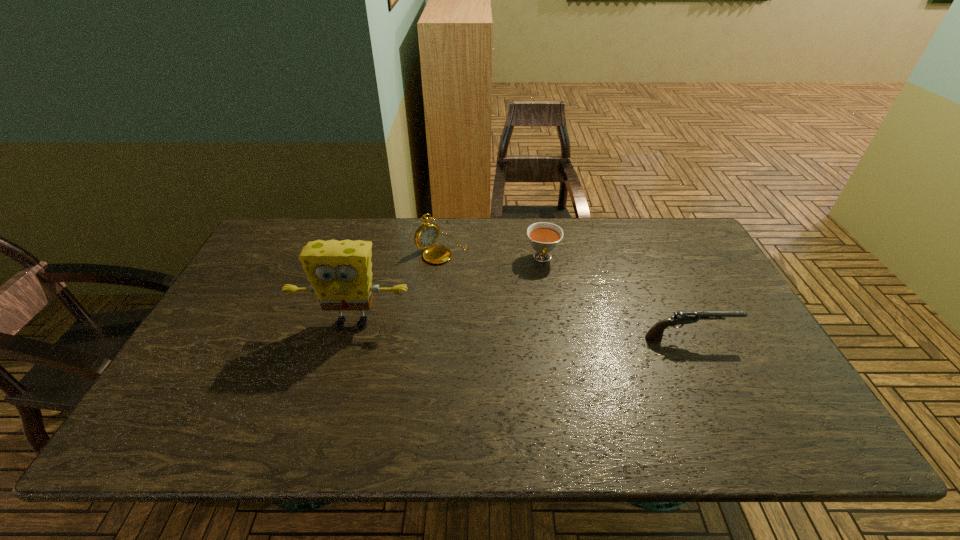
Locate an element on the screen. The width and height of the screenshot is (960, 540). vacant space at the far right corner of the desktop is located at coordinates (684, 253).

You are a GUI agent. You are given a task and a screenshot of the screen. Output one action in this format:
    pyautogui.click(x=<x>, y=<y>)
    Task: Click on the vacant space at the near right corner
    This screenshot has width=960, height=540.
    Given the screenshot: What is the action you would take?
    pyautogui.click(x=781, y=397)

At what (x,y) coordinates should I click in order to perform the action: click on free space between the pocket watch and the gun. Please return your answer as a coordinate pair (x, y). Looking at the image, I should click on (565, 293).

I want to click on vacant space in between the pocket watch and the teacup, so click(x=492, y=254).

Locate an element on the screen. vacant region between the rightmost object and the sponge is located at coordinates (521, 330).

Locate an element on the screen. This screenshot has width=960, height=540. free point between the pocket watch and the teacup is located at coordinates (492, 254).

This screenshot has width=960, height=540. What are the coordinates of `empty location between the second object from right to left and the gun` in the screenshot? It's located at (616, 298).

Locate an element on the screen. The width and height of the screenshot is (960, 540). empty location between the teacup and the sponge is located at coordinates (447, 291).

I want to click on empty location between the second tallest object and the third object from left to right, so click(492, 254).

This screenshot has width=960, height=540. In order to click on free space between the teacup and the pocket watch in this screenshot , I will do `click(492, 254)`.